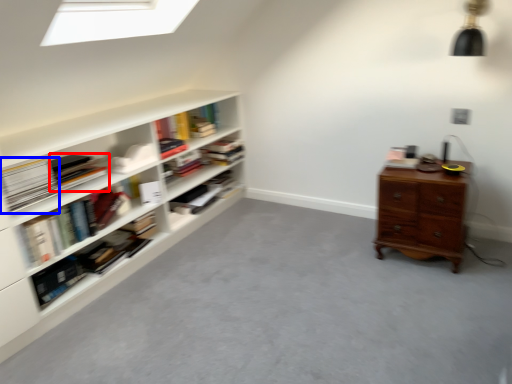
Question: Among these objects, which one is nearest to the camera, book (highlighted by a red box) or paperback book (highlighted by a blue box)?

Choices:
 (A) book
 (B) paperback book

Answer: (B)